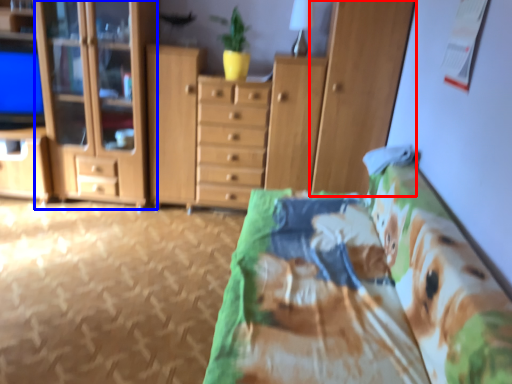
Question: Which of the following is the farthest to the observer, cabinetry (highlighted by a red box) or cabinetry (highlighted by a blue box)?

Choices:
 (A) cabinetry
 (B) cabinetry

Answer: (B)